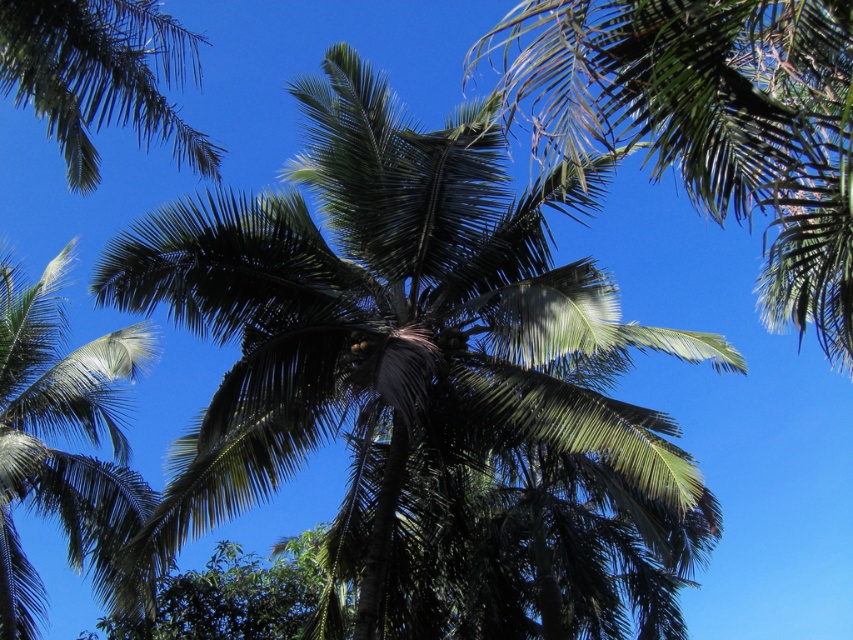
Question: Based on their relative distances, which object is nearer to the green leafy palm at center?

Choices:
 (A) green leafy coconut tree at center
 (B) green leafy palm at upper left

Answer: (B)

Question: Does green leafy palm at center have a smaller size compared to green leafy palm at upper left?

Choices:
 (A) yes
 (B) no

Answer: (A)

Question: Which object is farther from the camera taking this photo?

Choices:
 (A) green leafy coconut tree at center
 (B) green leafy palm tree at left

Answer: (B)

Question: Which point appears closest to the camera in this image?

Choices:
 (A) click(x=109, y=92)
 (B) click(x=51, y=285)

Answer: (A)

Question: Does green leafy coconut tree at center lie in front of green leafy palm at upper left?

Choices:
 (A) yes
 (B) no

Answer: (A)

Question: Does green leafy coconut tree at center lie behind green leafy palm tree at left?

Choices:
 (A) no
 (B) yes

Answer: (A)